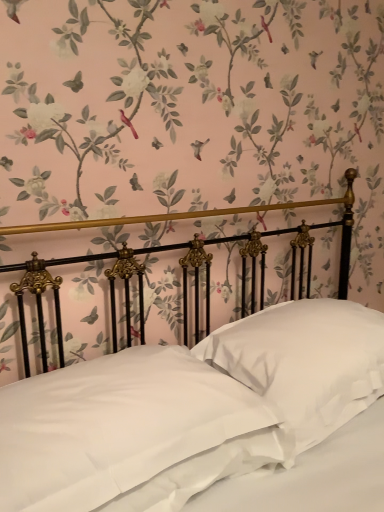
Question: In which direction should I rotate to look at white satin pillow at center, which appears as the first pillow when viewed from the left?

Choices:
 (A) left
 (B) right

Answer: (A)

Question: Which direction should I rotate to look at white satin pillow at center, which is the 1th pillow in right-to-left order, — up or down?

Choices:
 (A) down
 (B) up

Answer: (A)

Question: Does white satin pillow at center, which ranks as the 2th pillow in right-to-left order, appear on the right side of satin white bed at center?

Choices:
 (A) yes
 (B) no

Answer: (B)

Question: Considering the relative sizes of white satin pillow at center, which appears as the first pillow when viewed from the left, and satin white bed at center in the image provided, is white satin pillow at center, which appears as the first pillow when viewed from the left, smaller than satin white bed at center?

Choices:
 (A) yes
 (B) no

Answer: (A)

Question: Does white satin pillow at center, which appears as the first pillow when viewed from the left, have a greater width compared to satin white bed at center?

Choices:
 (A) yes
 (B) no

Answer: (B)

Question: Is white satin pillow at center, which ranks as the 2th pillow in right-to-left order, placed right next to satin white bed at center?

Choices:
 (A) no
 (B) yes

Answer: (B)

Question: Does white satin pillow at center, which ranks as the 2th pillow in right-to-left order, have a lesser height compared to satin white bed at center?

Choices:
 (A) yes
 (B) no

Answer: (A)

Question: Could you tell me if white satin pillow at center, which ranks as the 2th pillow in right-to-left order, is turned towards satin white bed at center?

Choices:
 (A) yes
 (B) no

Answer: (A)

Question: Does satin white bed at center touch white satin pillow at center, the second pillow when ordered from left to right?

Choices:
 (A) yes
 (B) no

Answer: (B)

Question: Are satin white bed at center and white satin pillow at center, which is the 1th pillow in right-to-left order, located far from each other?

Choices:
 (A) yes
 (B) no

Answer: (B)

Question: Considering the relative sizes of satin white bed at center and white satin pillow at center, which is the 1th pillow in right-to-left order, in the image provided, is satin white bed at center shorter than white satin pillow at center, which is the 1th pillow in right-to-left order,?

Choices:
 (A) no
 (B) yes

Answer: (A)

Question: From a real-world perspective, is satin white bed at center beneath white satin pillow at center, which is the 1th pillow in right-to-left order?

Choices:
 (A) no
 (B) yes

Answer: (A)

Question: Can we say satin white bed at center lies outside white satin pillow at center, the second pillow when ordered from left to right?

Choices:
 (A) yes
 (B) no

Answer: (A)

Question: Considering the relative sizes of satin white bed at center and white satin pillow at center, the second pillow when ordered from left to right, in the image provided, is satin white bed at center wider than white satin pillow at center, the second pillow when ordered from left to right,?

Choices:
 (A) yes
 (B) no

Answer: (A)

Question: Is white satin pillow at center, which appears as the first pillow when viewed from the left, taller than white satin pillow at center, the second pillow when ordered from left to right?

Choices:
 (A) yes
 (B) no

Answer: (B)